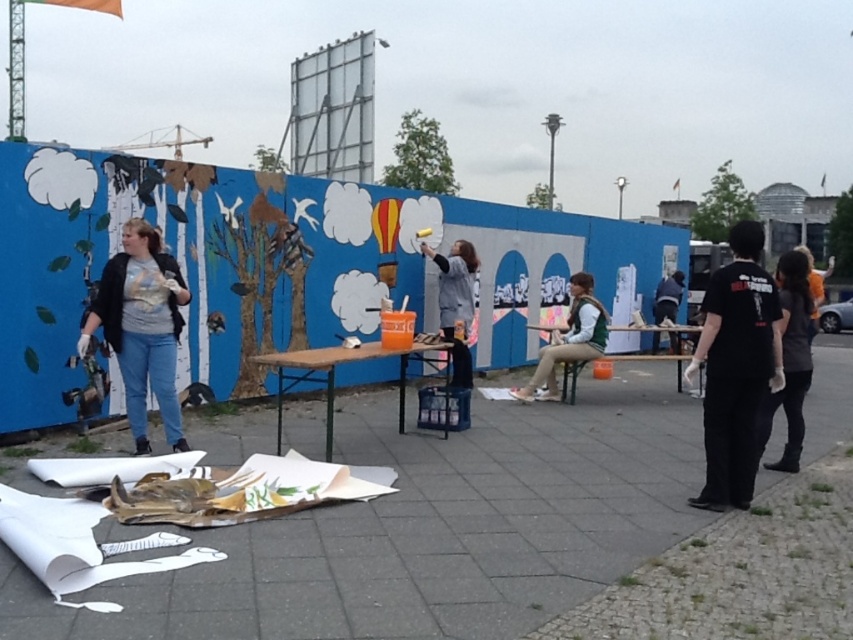
You are organizing a community mural event and need to distribute supplies. There are two volunteers wearing the matte gray shirt at left and the dark gray shirt at right. Which volunteer should you give a larger paintbrush to, based on their shirt sizes?

The matte gray shirt at left is bigger than the dark gray shirt at right, so you should give the larger paintbrush to the volunteer wearing the matte gray shirt at left.

You are standing in the outdoor mural painting area and notice two people wearing shirts. One is wearing a black matte shirt at right and the other a dark gray shirt at right. Which shirt is positioned lower on the image?

The black matte shirt at right is located below the dark gray shirt at right, so it is positioned lower in the image.